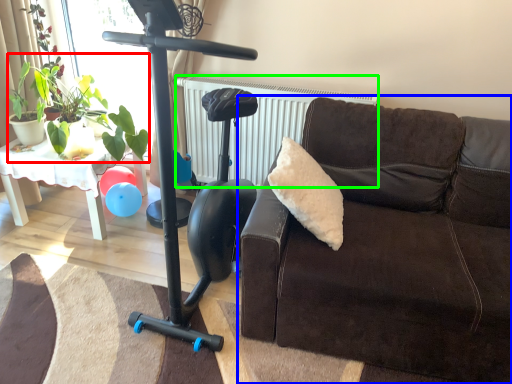
Question: Considering the real-world distances, which object is farthest from plant (highlighted by a red box)? studio couch (highlighted by a blue box) or radiator (highlighted by a green box)?

Choices:
 (A) studio couch
 (B) radiator

Answer: (A)